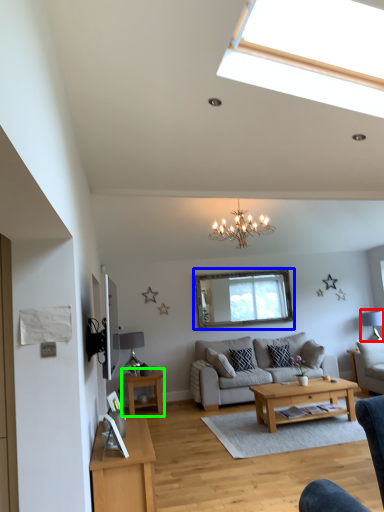
Question: Estimate the real-world distances between objects in this image. Which object is farther from lamp (highlighted by a red box), window screen (highlighted by a blue box) or table (highlighted by a green box)?

Choices:
 (A) window screen
 (B) table

Answer: (B)